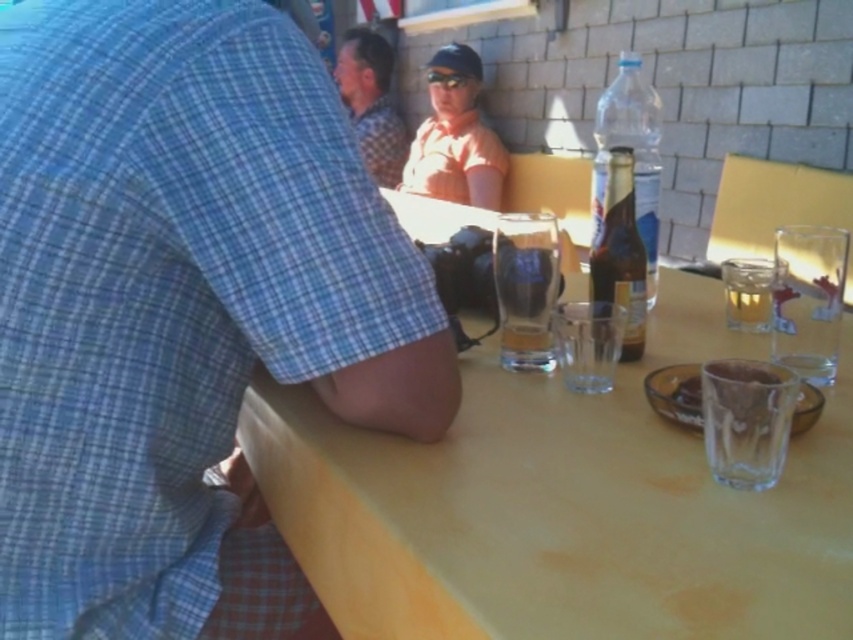
Is clear glass ashtray at lower right thinner than translucent glass at table center?

In fact, clear glass ashtray at lower right might be wider than translucent glass at table center.

Locate an element on the screen. The width and height of the screenshot is (853, 640). clear glass ashtray at lower right is located at coordinates (676, 394).

Can you confirm if blue plaid shirt at upper left is positioned to the right of clear glass beer at center?

Incorrect, blue plaid shirt at upper left is not on the right side of clear glass beer at center.

Does point (289, 616) come farther from viewer compared to point (519, 276)?

Yes, point (289, 616) is behind point (519, 276).

Where is `blue plaid shirt at upper left`? Image resolution: width=853 pixels, height=640 pixels. blue plaid shirt at upper left is located at coordinates (180, 307).

Does point (476, 410) come behind point (683, 385)?

That is True.

Does point (296, 420) come behind point (672, 380)?

No, it is not.

Locate an element on the screen. The width and height of the screenshot is (853, 640). yellow matte table at center is located at coordinates (561, 506).